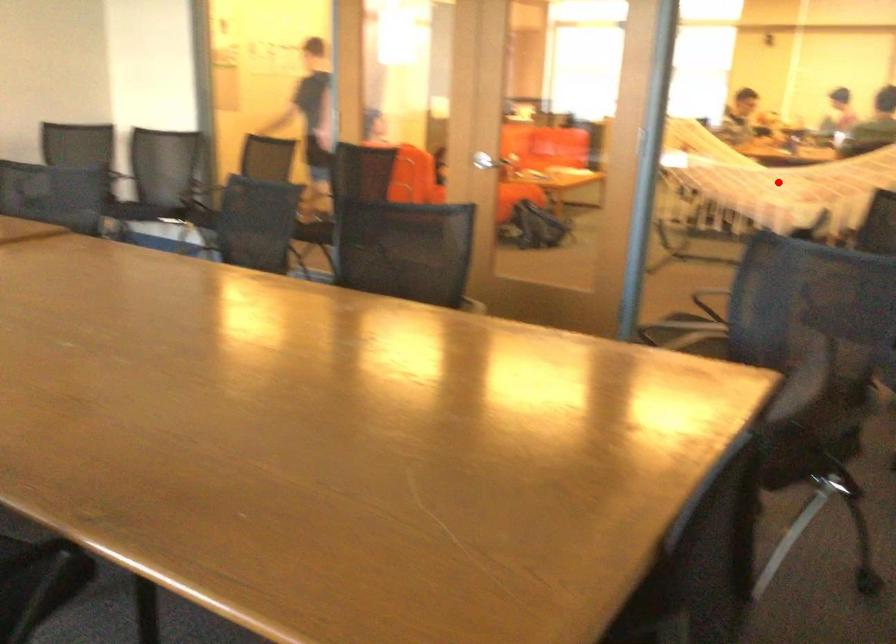
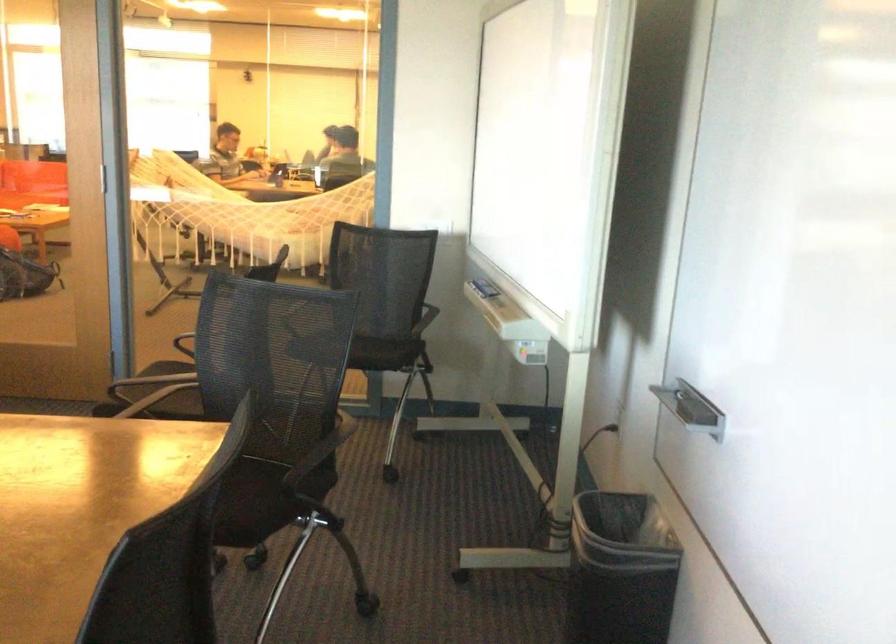
Question: I am providing you with two images of the same scene from different viewpoints. A red point is marked on the first image. Is the red point's position out of view in image 2?

Choices:
 (A) Yes
 (B) No

Answer: (A)